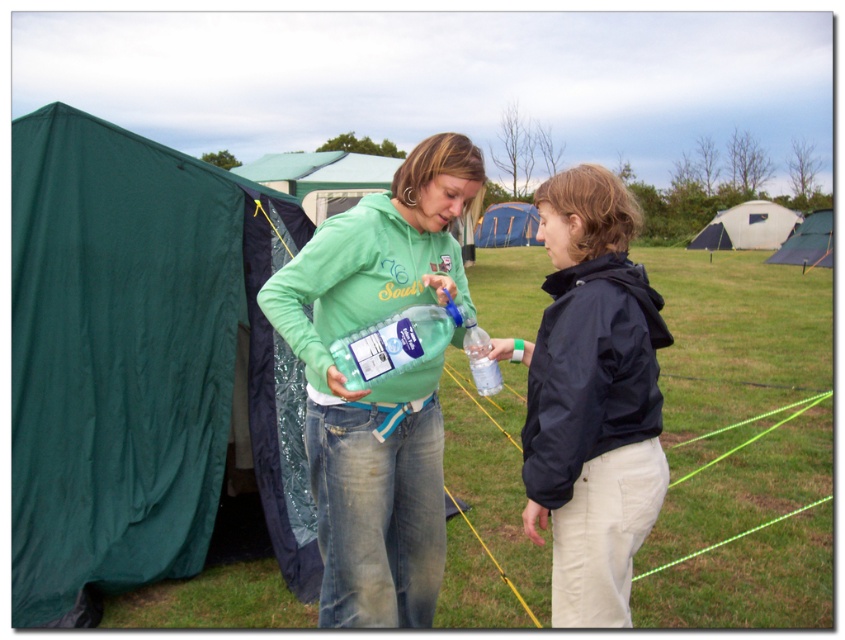
You are standing at the center of the image and see a point marked at coordinates (x=379, y=387). Which object does this point lie on?

The point at (x=379, y=387) lies on the green matte hoodie at center.

You are trying to locate the green matte hoodie at center in the image. Based on the coordinates provided, where would you look first?

The green matte hoodie at center is located at point coordinates (379, 387), so you should look towards the upper right area of the image since the x and y coordinates are both above 0.5.